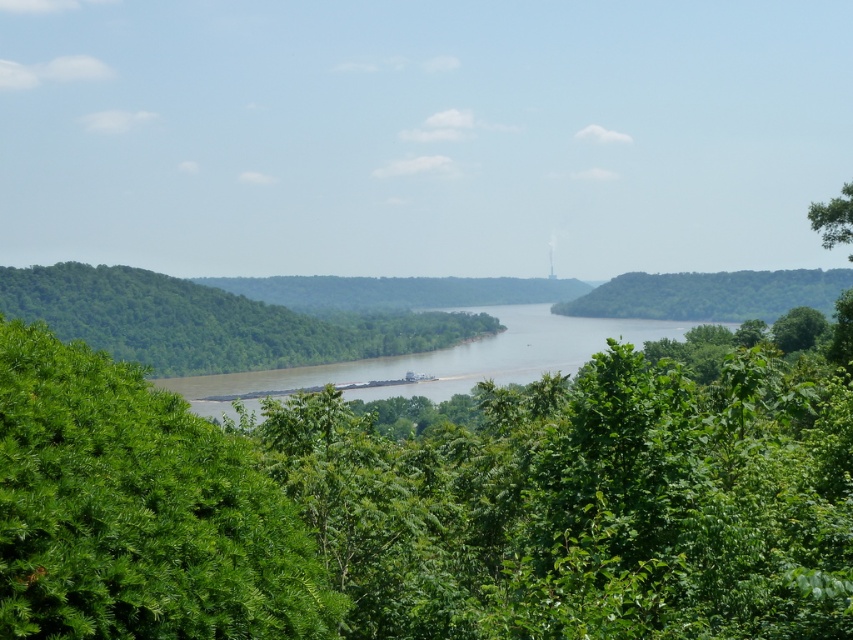
From the picture: You are standing in the middle of the scene and see the green leafy tree at center and the green leafy tree at left. Which tree is positioned to the right of the other?

The green leafy tree at center is positioned to the right of the green leafy tree at left.

You are standing at the point marked by the coordinates point (x=138, y=509) in the image. What object are you directly facing?

You are directly facing the green leafy tree at center marked by the coordinates point (x=138, y=509).

You are an environmental scientist assessing the landscape. You observe the green leafy tree at left and the green leafy tree at right. Which tree is closer to the viewer?

The green leafy tree at left is closer to the viewer because it is positioned under the green leafy tree at right, indicating it is in front.